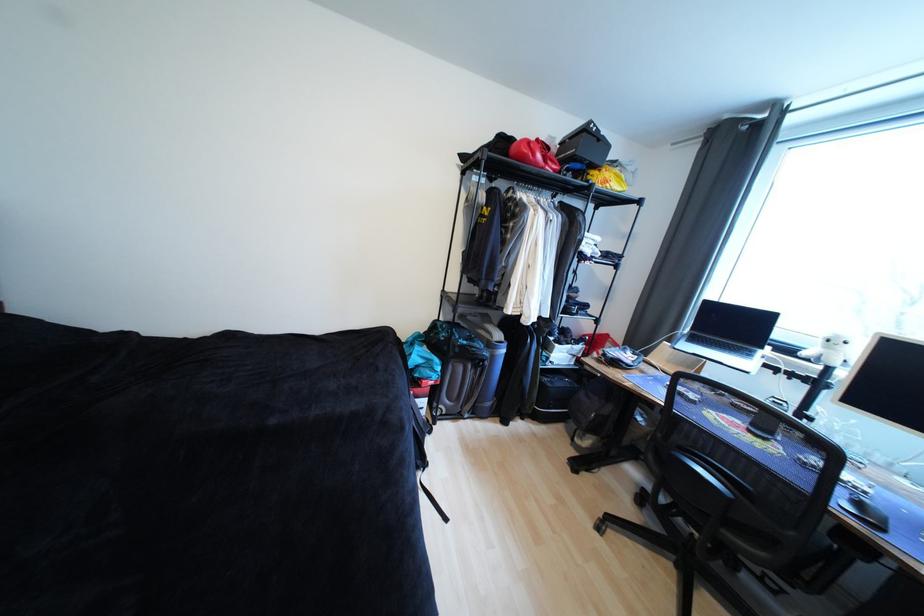
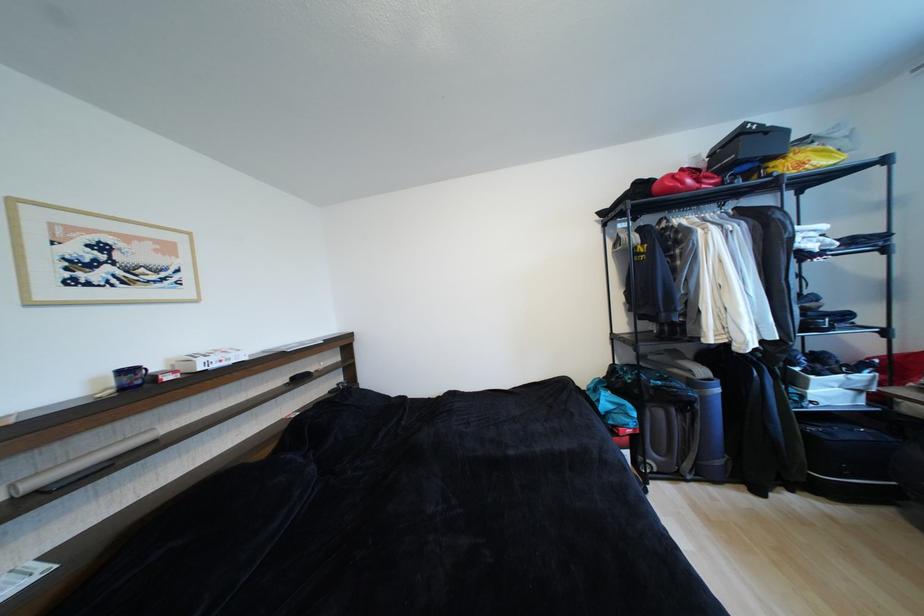
The images are taken continuously from a first-person perspective. In which direction is your viewpoint rotating?

The camera rotated toward left-up.